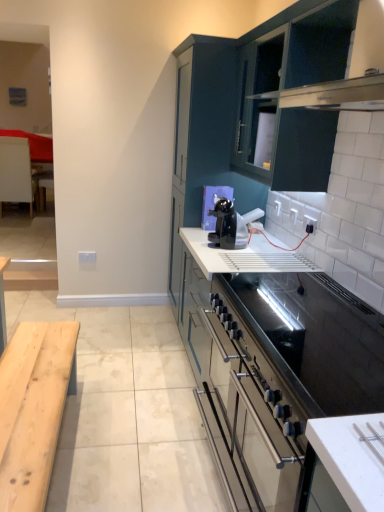
Question: From the image's perspective, relative to white wood table at left, is matte dark blue cabinet at upper center, the second cabinetry in the front-to-back sequence, above or below?

Choices:
 (A) below
 (B) above

Answer: (A)

Question: Is point (193, 177) positioned closer to the camera than point (23, 177)?

Choices:
 (A) farther
 (B) closer

Answer: (B)

Question: Which is farther from the white matte countertop at center?

Choices:
 (A) matte dark blue cabinet at upper center, the second cabinetry in the front-to-back sequence
 (B) white plastic electric outlet at center, acting as the 1th electric outlet starting from the left
 (C) dark teal cabinet at upper center, marked as the 2th cabinetry in a back-to-front arrangement
 (D) black glossy coffee machine at center
 (E) white wood table at left

Answer: (E)

Question: Which is farther from the dark teal cabinet at upper center, the first cabinetry positioned from the front?

Choices:
 (A) matte dark blue cabinet at upper center, the second cabinetry in the front-to-back sequence
 (B) white plastic electric outlet at center, the 1th electric outlet from the bottom
 (C) white glossy electric outlet at upper right, the 1th electric outlet viewed from the front
 (D) white matte countertop at center
 (E) black glossy coffee machine at center

Answer: (B)